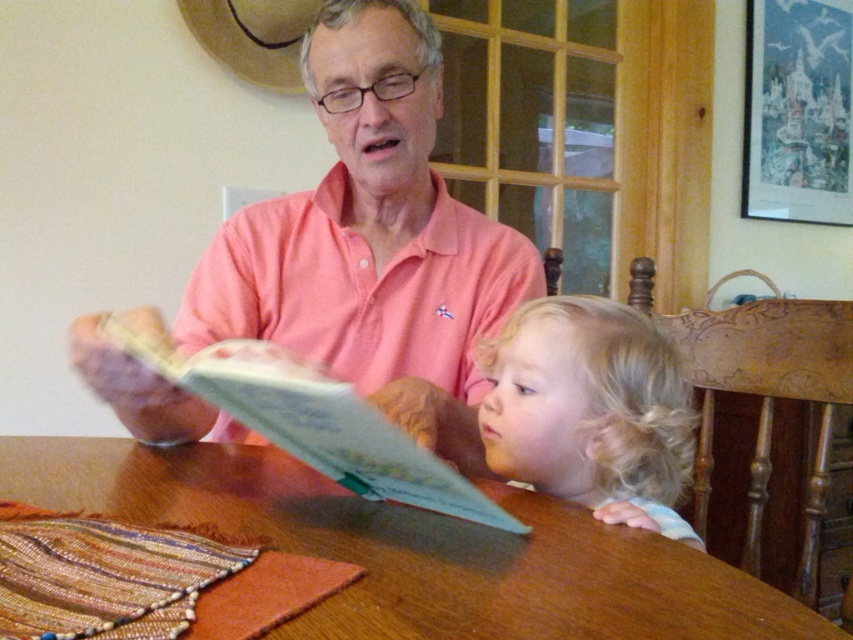
Is blonde hair at center thinner than light blue paper book at center?

Yes, blonde hair at center is thinner than light blue paper book at center.

From the picture: Can you confirm if blonde hair at center is positioned to the left of light blue paper book at center?

In fact, blonde hair at center is to the right of light blue paper book at center.

Find the location of a particular element. blonde hair at center is located at coordinates (590, 410).

This screenshot has height=640, width=853. Identify the location of blonde hair at center. (590, 410).

Does pink cotton shirt at center appear over blonde hair at center?

Indeed, pink cotton shirt at center is positioned over blonde hair at center.

Who is more distant from viewer, [321,269] or [556,401]?

Positioned behind is point [321,269].

What are the coordinates of `pink cotton shirt at center` in the screenshot? It's located at (370, 240).

Is wooden table at center bigger than blonde hair at center?

No, wooden table at center is not bigger than blonde hair at center.

Is point (76, 483) behind point (648, 333)?

No, it is not.

This screenshot has height=640, width=853. Identify the location of wooden table at center. (416, 548).